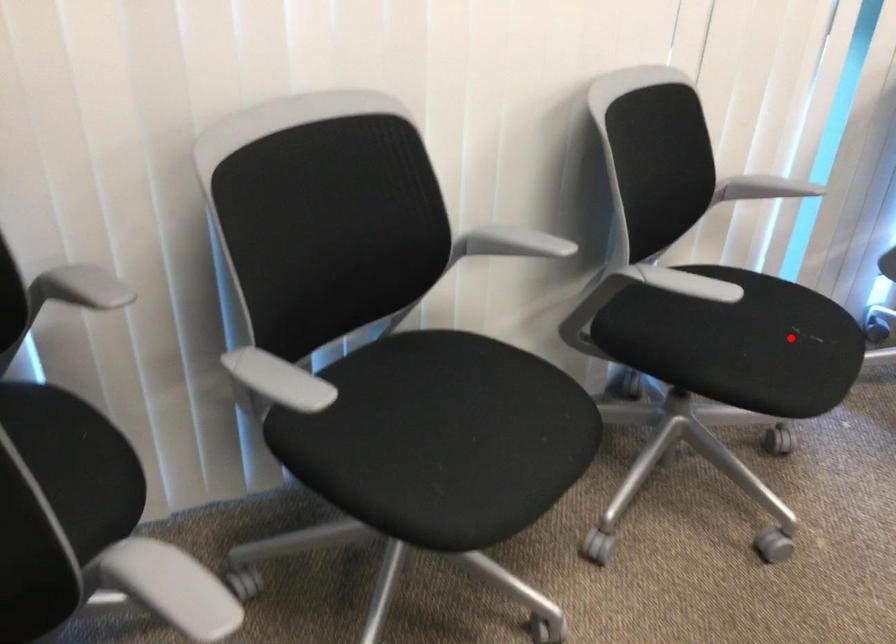
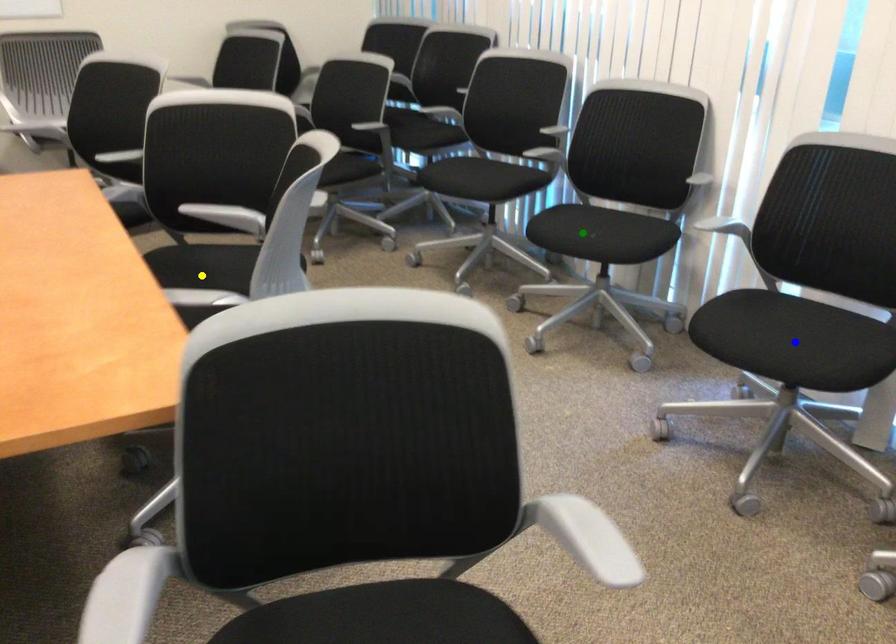
Question: I am providing you with two images of the same scene from different viewpoints. A red point is marked on the first image. You are given multiple points on the second image. Which point in image 2 represents the same 3d spot as the red point in image 1?

Choices:
 (A) yellow point
 (B) green point
 (C) blue point

Answer: (B)